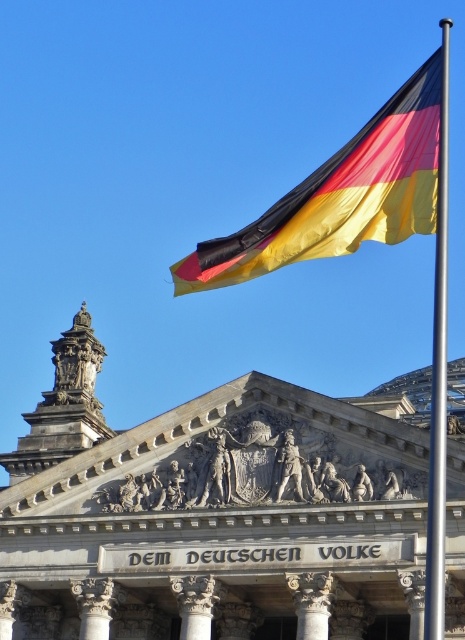
Question: Which of the following is the farthest from the observer?

Choices:
 (A) silver metallic pole at upper right
 (B) polyester flag at upper right

Answer: (B)

Question: Where is polyester flag at upper right located in relation to silver metallic pole at upper right in the image?

Choices:
 (A) right
 (B) left

Answer: (B)

Question: Is the position of polyester flag at upper right less distant than that of silver metallic pole at upper right?

Choices:
 (A) yes
 (B) no

Answer: (B)

Question: Which point is closer to the camera taking this photo?

Choices:
 (A) (354, 156)
 (B) (447, 83)

Answer: (B)

Question: Is polyester flag at upper right thinner than silver metallic pole at upper right?

Choices:
 (A) no
 (B) yes

Answer: (A)